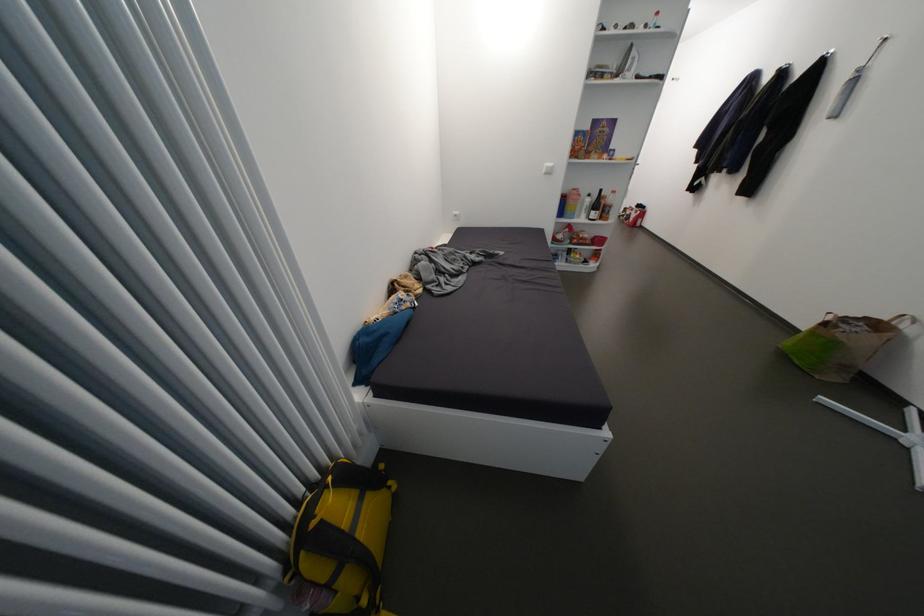
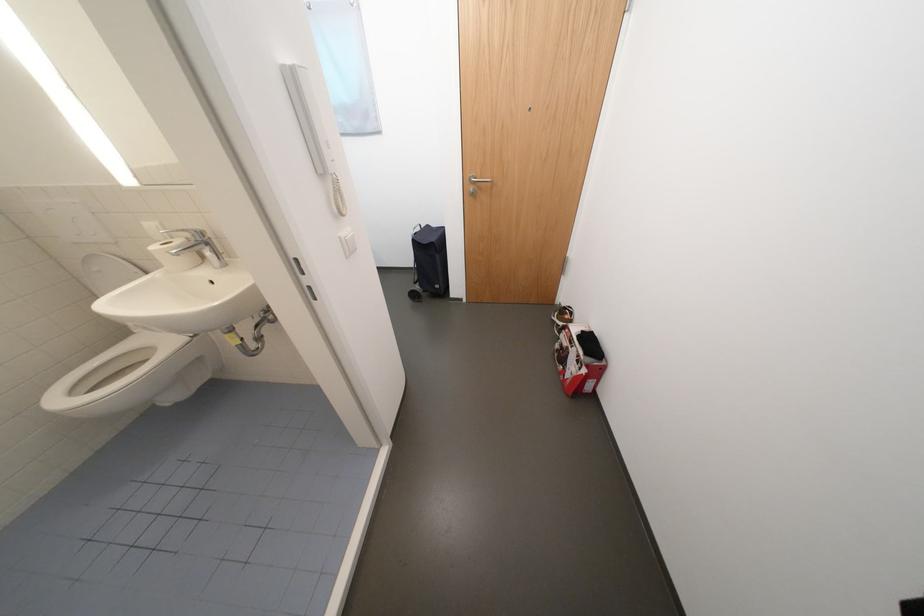
The point at (x=647, y=214) is marked in the first image. Where is the corresponding point in the second image?

(592, 371)